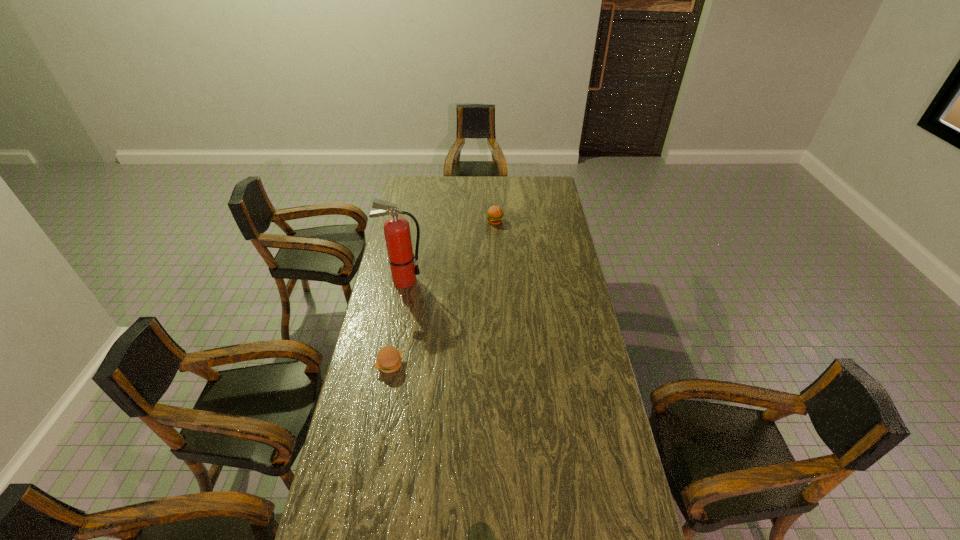
In order to click on fire extinguisher in this screenshot , I will do [397, 233].

At what (x,y) coordinates should I click in order to perform the action: click on the tallest object. Please return your answer as a coordinate pair (x, y). Image resolution: width=960 pixels, height=540 pixels. Looking at the image, I should click on (397, 233).

This screenshot has height=540, width=960. In order to click on the farther hamburger in this screenshot , I will do `click(495, 214)`.

Find the location of a particular element. The width and height of the screenshot is (960, 540). the rightmost object is located at coordinates coord(495,214).

This screenshot has height=540, width=960. Identify the location of the left hamburger. (388, 360).

Locate an element on the screen. This screenshot has height=540, width=960. the nearest object is located at coordinates (388, 360).

Identify the location of vacant space located 0.350m on the hose direction of the tallest object. This screenshot has height=540, width=960. (502, 280).

Where is `free point located on the back of the right hamburger`? The width and height of the screenshot is (960, 540). free point located on the back of the right hamburger is located at coordinates (x=494, y=207).

The width and height of the screenshot is (960, 540). What are the coordinates of `vacant area situated on the back of the nearer hamburger` in the screenshot? It's located at (401, 305).

Image resolution: width=960 pixels, height=540 pixels. Find the location of `fire extinguisher located in the left edge section of the desktop`. fire extinguisher located in the left edge section of the desktop is located at coordinates (397, 233).